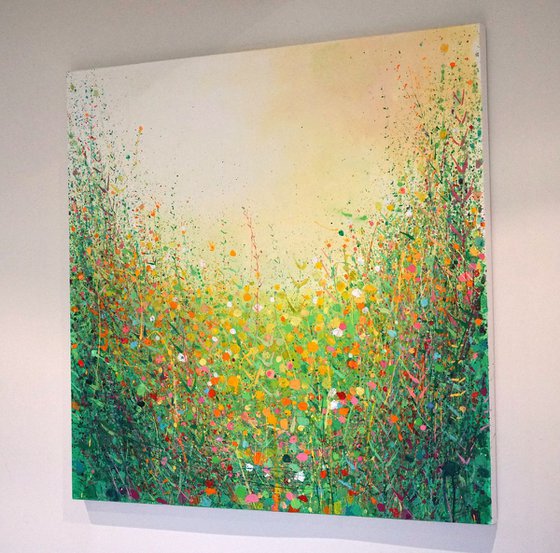
The width and height of the screenshot is (560, 553). Identify the location of right edge of painting. (485, 193).